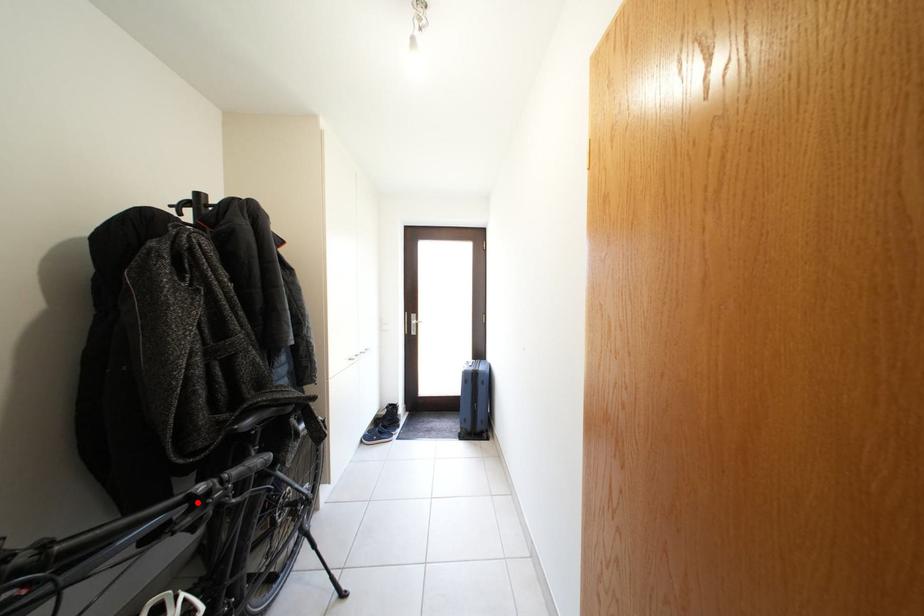
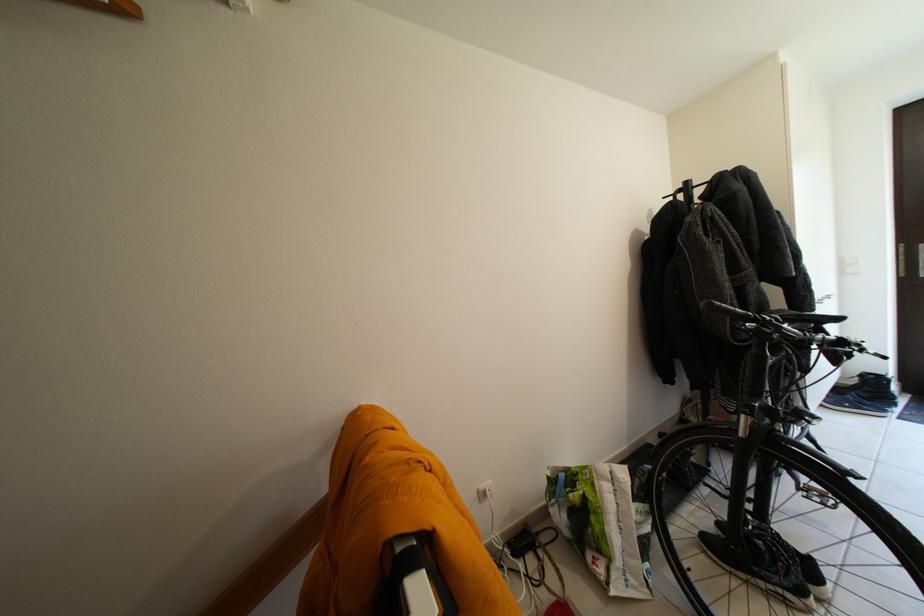
Where in the second image is the point corresponding to the highlighted location from the first image?

(849, 344)